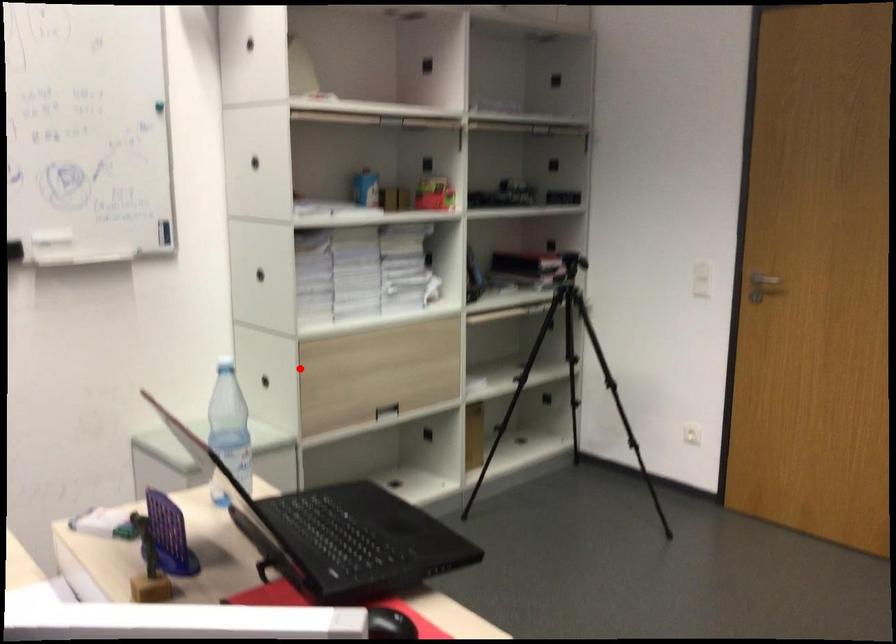
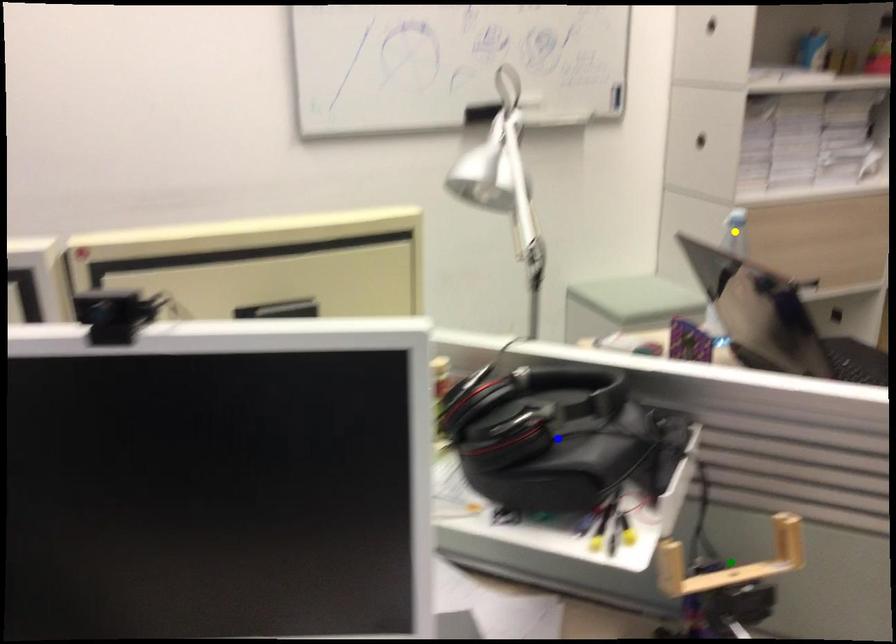
Question: I am providing you with two images of the same scene from different viewpoints. A red point is marked on the first image. You are given multiple points on the second image. Which point in image 2 represents the same 3d spot as the red point in image 1?

Choices:
 (A) blue point
 (B) yellow point
 (C) green point

Answer: (B)